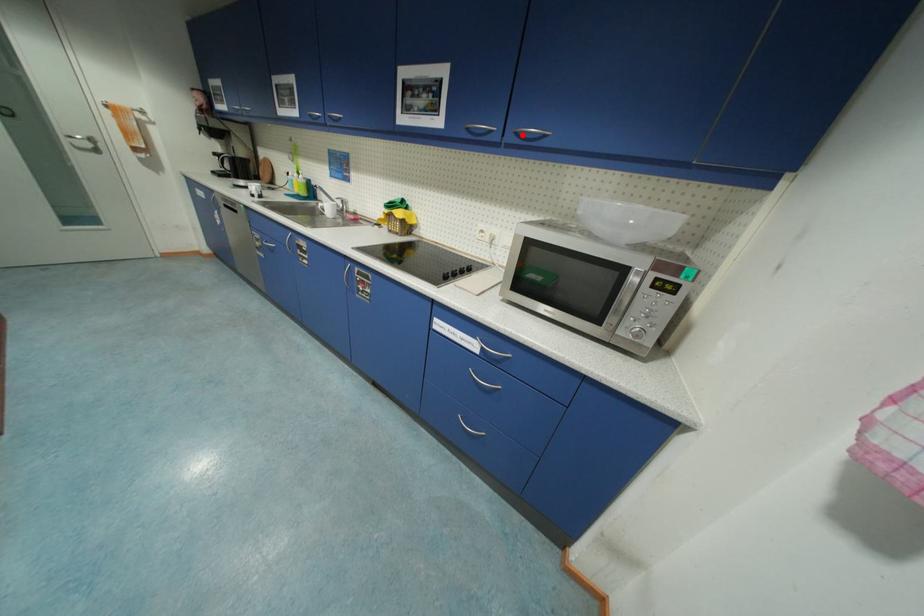
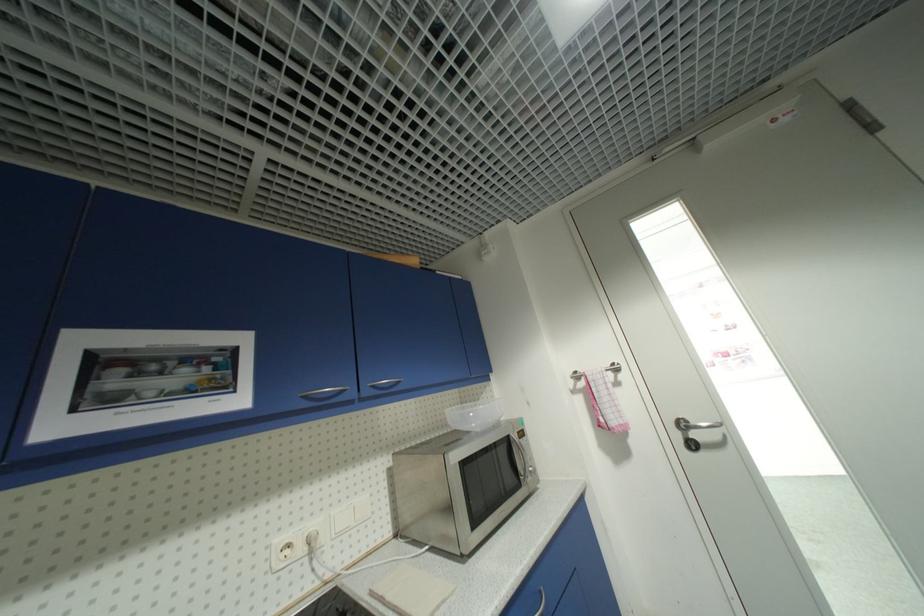
Where in the second image is the point corresponding to the highlighted location from the first image?

(379, 387)